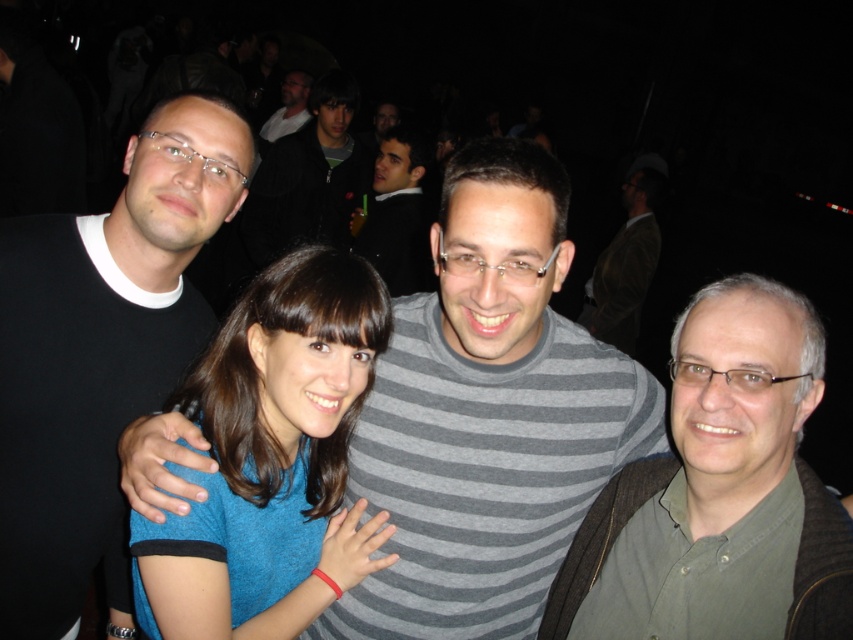
Is black matte shirt at left closer to camera compared to dark gray striped sweater at center?

Yes, black matte shirt at left is closer to the viewer.

Is black matte shirt at left wider than dark gray striped sweater at center?

Yes, black matte shirt at left is wider than dark gray striped sweater at center.

Is point (802, 323) positioned in front of point (405, 246)?

Yes.

The image size is (853, 640). I want to click on black matte shirt at left, so click(x=718, y=492).

I want to click on dark gray striped sweater at center, so click(x=396, y=212).

This screenshot has width=853, height=640. In order to click on dark gray striped sweater at center in this screenshot , I will do `click(396, 212)`.

How distant is green matte shirt at right from dark gray sweater at upper center?

The distance of green matte shirt at right from dark gray sweater at upper center is 3.03 meters.

Which is in front, point (764, 456) or point (310, 214)?

Positioned in front is point (764, 456).

Locate an element on the screen. This screenshot has height=640, width=853. green matte shirt at right is located at coordinates (720, 488).

The width and height of the screenshot is (853, 640). What are the coordinates of `green matte shirt at right` in the screenshot? It's located at (720, 488).